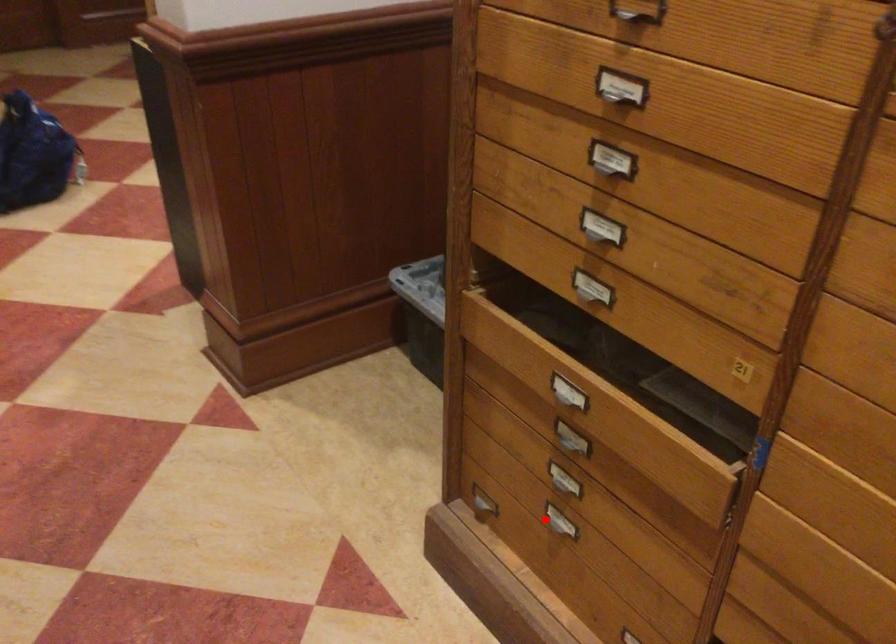
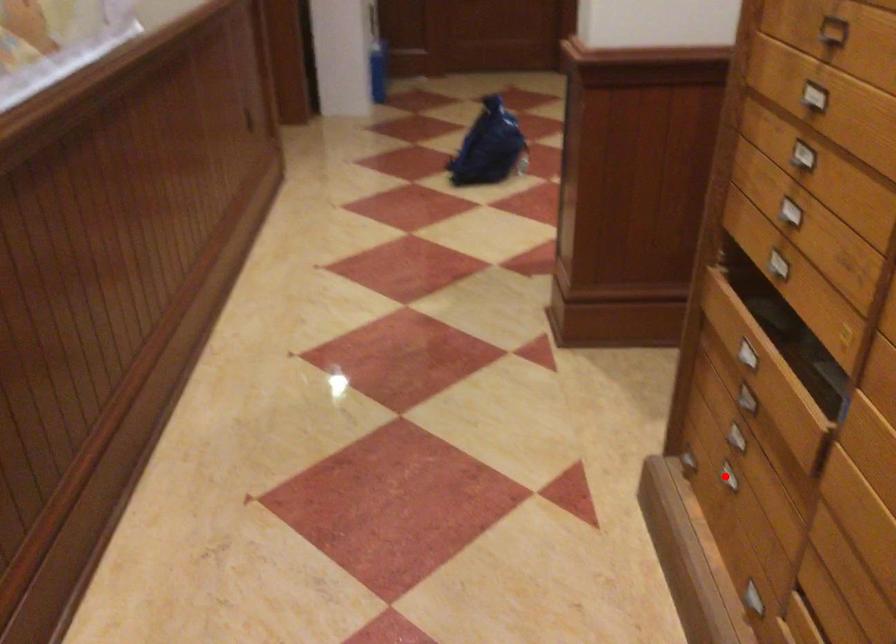
I am providing you with two images of the same scene from different viewpoints. A red point is marked on the first image and another point is marked on the second image. Does the point marked in image1 correspond to the same location as the one in image2?

Yes